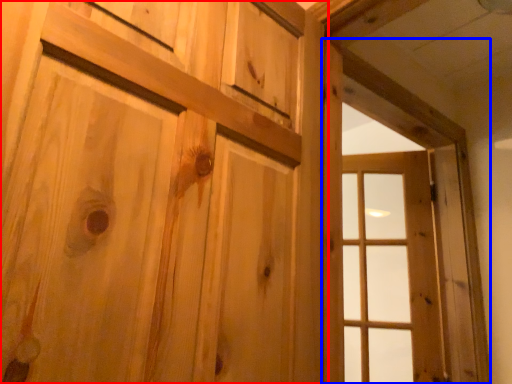
Question: Which point is closer to the camera, door (highlighted by a red box) or window frame (highlighted by a blue box)?

Choices:
 (A) door
 (B) window frame

Answer: (A)